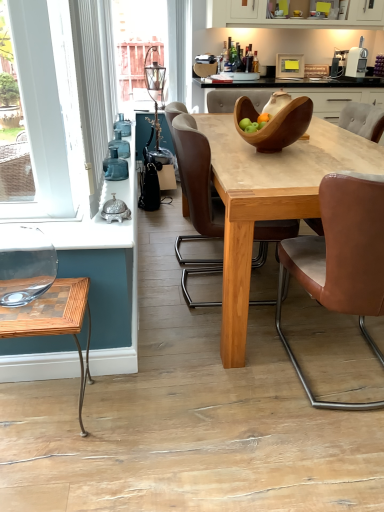
Identify the location of empty space that is to the right of wooden checkered coffee table at lower left. (141, 418).